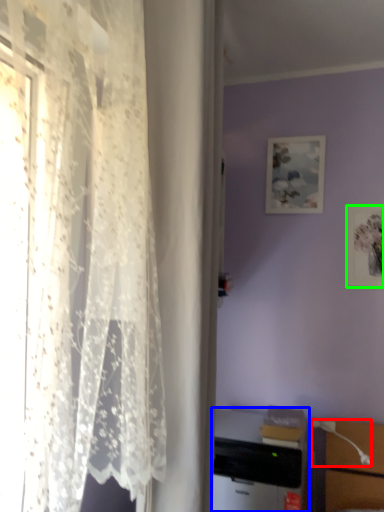
Question: Which object is positioned farthest from table lamp (highlighted by a red box)? Select from desktop computer (highlighted by a blue box) and picture frame (highlighted by a green box).

Choices:
 (A) desktop computer
 (B) picture frame

Answer: (B)